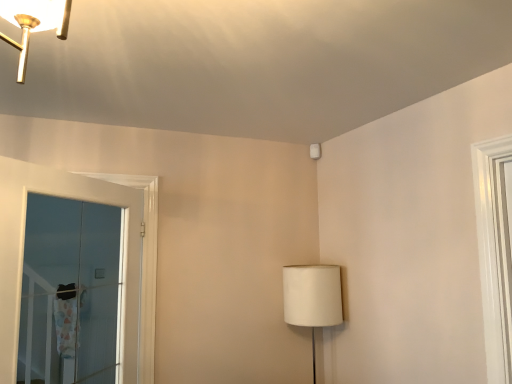
Find the location of a particular element. white fabric lampshade at lower right is located at coordinates (312, 298).

Image resolution: width=512 pixels, height=384 pixels. Describe the element at coordinates (312, 298) in the screenshot. I see `white fabric lampshade at lower right` at that location.

What do you see at coordinates (70, 292) in the screenshot?
I see `transparent glass door at left` at bounding box center [70, 292].

Image resolution: width=512 pixels, height=384 pixels. Find the location of `transparent glass door at left`. transparent glass door at left is located at coordinates (70, 292).

Identify the location of white fabric lampshade at lower right. (312, 298).

Based on their positions, is transparent glass door at left located to the left or right of white fabric lampshade at lower right?

transparent glass door at left is to the left of white fabric lampshade at lower right.

Considering their positions, is transparent glass door at left located in front of or behind white fabric lampshade at lower right?

Visually, transparent glass door at left is located in front of white fabric lampshade at lower right.

Is point (44, 351) closer or farther from the camera than point (325, 291)?

Clearly, point (44, 351) is more distant from the camera than point (325, 291).

From the image's perspective, is transparent glass door at left located beneath white fabric lampshade at lower right?

Actually, transparent glass door at left appears above white fabric lampshade at lower right in the image.

From a real-world perspective, which object rests below the other?

In real-world perspective, white fabric lampshade at lower right is lower.

Which object is wider, transparent glass door at left or white fabric lampshade at lower right?

Wider between the two is white fabric lampshade at lower right.

Can you confirm if transparent glass door at left is taller than white fabric lampshade at lower right?

Indeed, transparent glass door at left has a greater height compared to white fabric lampshade at lower right.

Based on their sizes in the image, would you say transparent glass door at left is bigger or smaller than white fabric lampshade at lower right?

Clearly, transparent glass door at left is larger in size than white fabric lampshade at lower right.

Would you say transparent glass door at left is outside white fabric lampshade at lower right?

Absolutely, transparent glass door at left is external to white fabric lampshade at lower right.

Are transparent glass door at left and white fabric lampshade at lower right beside each other?

There is a gap between transparent glass door at left and white fabric lampshade at lower right.

Is transparent glass door at left oriented away from white fabric lampshade at lower right?

No, transparent glass door at left's orientation is not away from white fabric lampshade at lower right.

Locate an element on the screen. window above the white fabric lampshade at lower right (from a real-world perspective) is located at coordinates (70, 292).

Based on their positions, is white fabric lampshade at lower right located to the left or right of transparent glass door at left?

white fabric lampshade at lower right is positioned on transparent glass door at left's right side.

Considering the relative positions of white fabric lampshade at lower right and transparent glass door at left in the image provided, is white fabric lampshade at lower right behind transparent glass door at left?

Yes.

From the picture: Which point is more distant from viewer, (335, 265) or (78, 206)?

The point (78, 206) is behind.

From the image's perspective, is white fabric lampshade at lower right located above or below transparent glass door at left?

Clearly, from the image's perspective, white fabric lampshade at lower right is below transparent glass door at left.

In the scene shown: From a real-world perspective, is white fabric lampshade at lower right located beneath transparent glass door at left?

Yes.

In terms of width, does white fabric lampshade at lower right look wider or thinner when compared to transparent glass door at left?

Clearly, white fabric lampshade at lower right has more width compared to transparent glass door at left.

Who is shorter, white fabric lampshade at lower right or transparent glass door at left?

Standing shorter between the two is white fabric lampshade at lower right.

Considering the relative sizes of white fabric lampshade at lower right and transparent glass door at left in the image provided, is white fabric lampshade at lower right bigger than transparent glass door at left?

Actually, white fabric lampshade at lower right might be smaller than transparent glass door at left.

Would you say white fabric lampshade at lower right is outside transparent glass door at left?

Yes.

Is white fabric lampshade at lower right positioned far away from transparent glass door at left?

Absolutely, white fabric lampshade at lower right is distant from transparent glass door at left.

Does white fabric lampshade at lower right turn towards transparent glass door at left?

Yes, white fabric lampshade at lower right is turned towards transparent glass door at left.

Can you tell me how much white fabric lampshade at lower right and transparent glass door at left differ in facing direction?

The facing directions of white fabric lampshade at lower right and transparent glass door at left are 141 degrees apart.

You are a GUI agent. You are given a task and a screenshot of the screen. Output one action in this format:
    pyautogui.click(x=<x>, y=<y>)
    Task: Click on the table lamp on the right of the transparent glass door at left
    The width and height of the screenshot is (512, 384).
    Given the screenshot: What is the action you would take?
    pyautogui.click(x=312, y=298)

What are the coordinates of `table lamp that is under the transparent glass door at left (from a real-world perspective)` in the screenshot? It's located at (312, 298).

Locate an element on the screen. table lamp behind the transparent glass door at left is located at coordinates (312, 298).